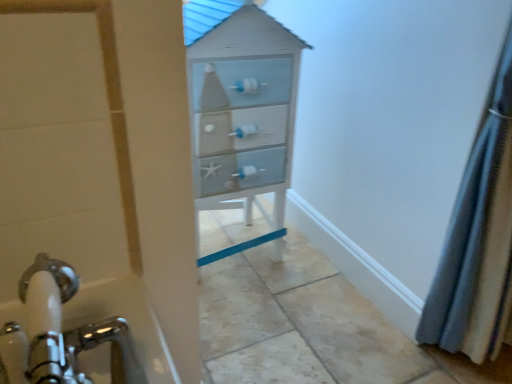
Question: Does light blue painted wood chest of drawers at center have a greater width compared to gray fabric shower curtain at right?

Choices:
 (A) no
 (B) yes

Answer: (B)

Question: Is light blue painted wood chest of drawers at center next to gray fabric shower curtain at right?

Choices:
 (A) no
 (B) yes

Answer: (A)

Question: Can you confirm if light blue painted wood chest of drawers at center is smaller than gray fabric shower curtain at right?

Choices:
 (A) yes
 (B) no

Answer: (B)

Question: Is light blue painted wood chest of drawers at center positioned behind gray fabric shower curtain at right?

Choices:
 (A) yes
 (B) no

Answer: (A)

Question: Is light blue painted wood chest of drawers at center aimed at gray fabric shower curtain at right?

Choices:
 (A) no
 (B) yes

Answer: (A)

Question: From a real-world perspective, is light blue painted wood chest of drawers at center over gray fabric shower curtain at right?

Choices:
 (A) yes
 (B) no

Answer: (B)

Question: Can you confirm if gray fabric shower curtain at right is smaller than light blue painted wood chest of drawers at center?

Choices:
 (A) yes
 (B) no

Answer: (A)

Question: Is gray fabric shower curtain at right surrounding light blue painted wood chest of drawers at center?

Choices:
 (A) no
 (B) yes

Answer: (A)

Question: From the image's perspective, is gray fabric shower curtain at right on light blue painted wood chest of drawers at center?

Choices:
 (A) no
 (B) yes

Answer: (A)

Question: Could you tell me if gray fabric shower curtain at right is facing light blue painted wood chest of drawers at center?

Choices:
 (A) no
 (B) yes

Answer: (A)

Question: Does gray fabric shower curtain at right lie in front of light blue painted wood chest of drawers at center?

Choices:
 (A) yes
 (B) no

Answer: (A)

Question: From the image's perspective, is gray fabric shower curtain at right beneath light blue painted wood chest of drawers at center?

Choices:
 (A) yes
 (B) no

Answer: (A)

Question: In the image, is gray fabric shower curtain at right positioned in front of or behind light blue painted wood chest of drawers at center?

Choices:
 (A) behind
 (B) front

Answer: (B)